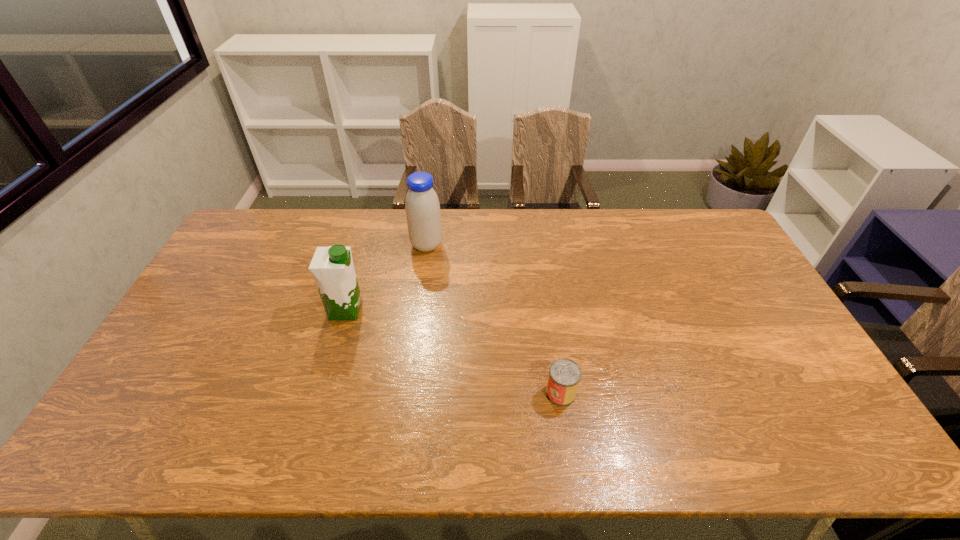
This screenshot has width=960, height=540. In order to click on free space that satisfies the following two spatial constraints: 1. on the front side of the farthest object; 2. on the right side of the can in this screenshot , I will do `click(406, 393)`.

This screenshot has height=540, width=960. What are the coordinates of `free spot that satisfies the following two spatial constraints: 1. on the front-facing side of the left soya milk; 2. on the right side of the shortest object` in the screenshot? It's located at (322, 393).

You are a GUI agent. You are given a task and a screenshot of the screen. Output one action in this format:
    pyautogui.click(x=<x>, y=<y>)
    Task: Click on the free point that satisfies the following two spatial constraints: 1. on the back side of the nearest object; 2. on the front-facing side of the leftmost object
    The height and width of the screenshot is (540, 960).
    Given the screenshot: What is the action you would take?
    pyautogui.click(x=548, y=310)